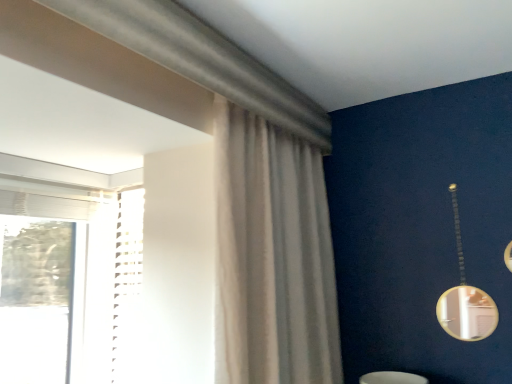
The image size is (512, 384). In order to click on gold metallic mirror at right in this screenshot , I will do coord(465,298).

What is the approximate height of gold metallic mirror at right?

gold metallic mirror at right is 25.32 inches in height.

Describe the element at coordinates (465, 298) in the screenshot. I see `gold metallic mirror at right` at that location.

You are a GUI agent. You are given a task and a screenshot of the screen. Output one action in this format:
    pyautogui.click(x=<x>, y=<y>)
    Task: Click on the sheer white curtain at center
    This screenshot has height=384, width=512.
    Given the screenshot: What is the action you would take?
    pyautogui.click(x=272, y=256)

This screenshot has height=384, width=512. What do you see at coordinates (272, 256) in the screenshot?
I see `sheer white curtain at center` at bounding box center [272, 256].

Identify the location of gold metallic mirror at right. The height and width of the screenshot is (384, 512). (465, 298).

Which is more to the left, sheer white curtain at center or gold metallic mirror at right?

From the viewer's perspective, sheer white curtain at center appears more on the left side.

Between sheer white curtain at center and gold metallic mirror at right, which one is positioned in front?

sheer white curtain at center.

Between point (314, 234) and point (460, 278), which one is positioned in front?

The point (460, 278) is more forward.

From the image's perspective, which one is positioned lower, sheer white curtain at center or gold metallic mirror at right?

gold metallic mirror at right is shown below in the image.

From a real-world perspective, is sheer white curtain at center positioned over gold metallic mirror at right based on gravity?

Yes, from a real-world perspective, sheer white curtain at center is on top of gold metallic mirror at right.

Does sheer white curtain at center have a greater width compared to gold metallic mirror at right?

Indeed, sheer white curtain at center has a greater width compared to gold metallic mirror at right.

Does sheer white curtain at center have a lesser height compared to gold metallic mirror at right?

No.

In the scene shown: Who is smaller, sheer white curtain at center or gold metallic mirror at right?

gold metallic mirror at right is smaller.

Is gold metallic mirror at right surrounded by sheer white curtain at center?

No, gold metallic mirror at right is not a part of sheer white curtain at center.

Is sheer white curtain at center positioned far away from gold metallic mirror at right?

No, sheer white curtain at center is not far away from gold metallic mirror at right.

Could you tell me if sheer white curtain at center is facing gold metallic mirror at right?

Yes.

In the scene shown: Can you tell me how much sheer white curtain at center and gold metallic mirror at right differ in facing direction?

The facing directions of sheer white curtain at center and gold metallic mirror at right are 90.1 degrees apart.

Measure the distance from sheer white curtain at center to gold metallic mirror at right.

sheer white curtain at center and gold metallic mirror at right are 27.53 inches apart.

Find the location of a particular element. mirror located below the sheer white curtain at center (from the image's perspective) is located at coordinates (465, 298).

Looking at this image, considering the positions of objects gold metallic mirror at right and sheer white curtain at center in the image provided, who is more to the left, gold metallic mirror at right or sheer white curtain at center?

sheer white curtain at center is more to the left.

Which object is further away from the camera, gold metallic mirror at right or sheer white curtain at center?

gold metallic mirror at right is further from the camera.

Which is in front, point (494, 305) or point (261, 208)?

The point (261, 208) is in front.

From the image's perspective, who appears lower, gold metallic mirror at right or sheer white curtain at center?

gold metallic mirror at right.

From a real-world perspective, which is physically below, gold metallic mirror at right or sheer white curtain at center?

gold metallic mirror at right.

Can you confirm if gold metallic mirror at right is thinner than sheer white curtain at center?

Correct, the width of gold metallic mirror at right is less than that of sheer white curtain at center.

Which of these two, gold metallic mirror at right or sheer white curtain at center, stands shorter?

With less height is gold metallic mirror at right.

In the scene shown: Which of these two, gold metallic mirror at right or sheer white curtain at center, is bigger?

With larger size is sheer white curtain at center.

Is gold metallic mirror at right surrounding sheer white curtain at center?

No, sheer white curtain at center is located outside of gold metallic mirror at right.

Is gold metallic mirror at right positioned far away from sheer white curtain at center?

gold metallic mirror at right is near sheer white curtain at center, not far away.

Could you tell me if gold metallic mirror at right is turned towards sheer white curtain at center?

No, gold metallic mirror at right is not oriented towards sheer white curtain at center.

Where is `curtain on the left of the gold metallic mirror at right`? This screenshot has width=512, height=384. curtain on the left of the gold metallic mirror at right is located at coordinates (272, 256).

Find the location of a particular element. Image resolution: width=512 pixels, height=384 pixels. curtain on the left of gold metallic mirror at right is located at coordinates (272, 256).

Find the location of a particular element. The width and height of the screenshot is (512, 384). mirror behind the sheer white curtain at center is located at coordinates (465, 298).